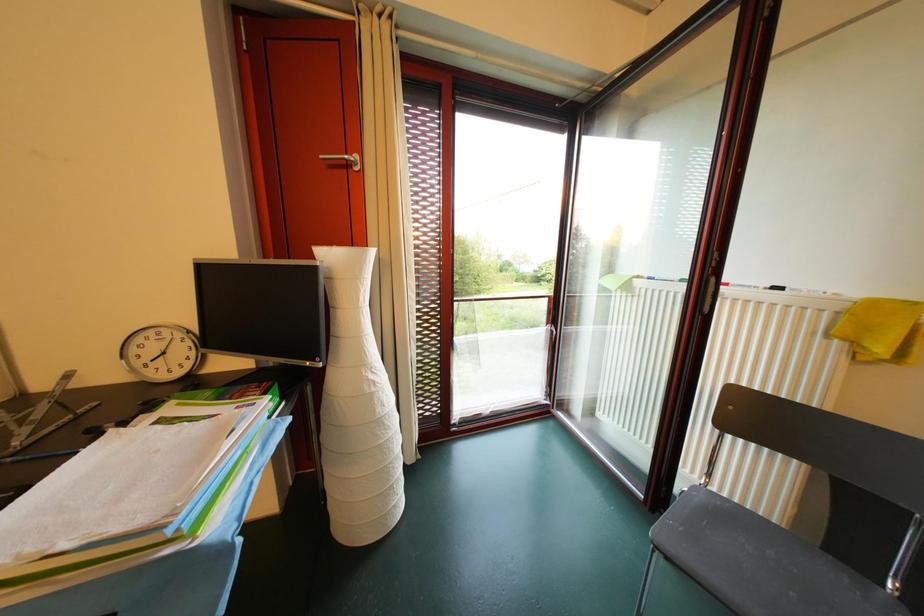
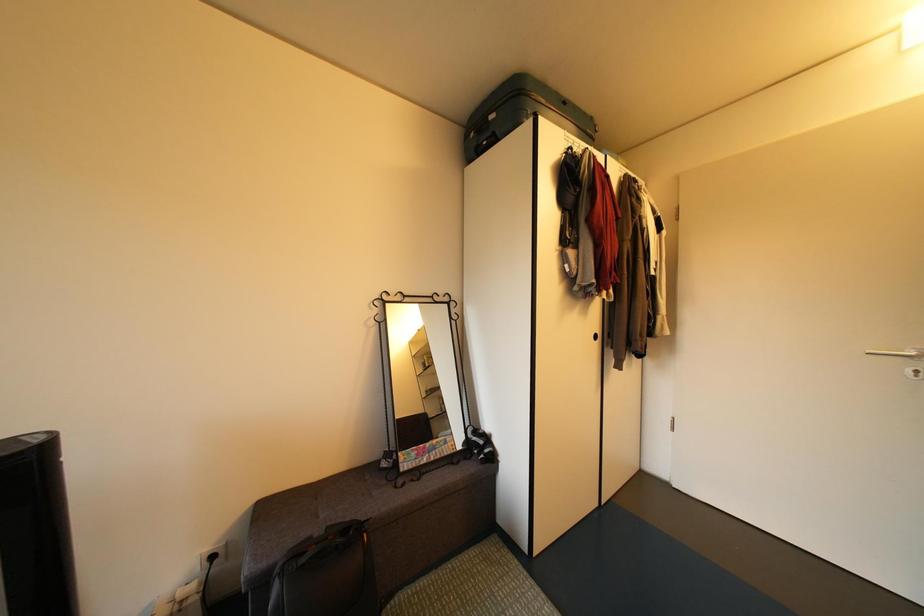
Question: The first image is from the beginning of the video and the second image is from the end. How did the camera likely rotate when shooting the video?

Choices:
 (A) Left
 (B) Right
 (C) Up
 (D) Down

Answer: (B)